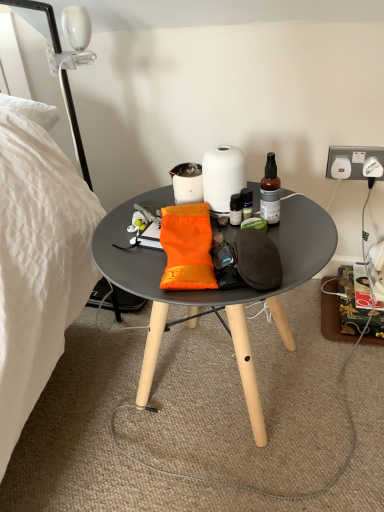
Measure the distance between point (346,172) and camera.

Point (346,172) is 3.65 feet away from camera.

The width and height of the screenshot is (384, 512). What do you see at coordinates (222, 176) in the screenshot?
I see `white matte paper towel at center` at bounding box center [222, 176].

The image size is (384, 512). What do you see at coordinates (187, 183) in the screenshot?
I see `matte white coffee cup at center` at bounding box center [187, 183].

At what (x,y) coordinates should I click in order to perform the action: click on matte black table at center. Please return your answer as a coordinate pair (x, y). This screenshot has width=384, height=512. Looking at the image, I should click on (213, 290).

Identify the location of translucent glass bottle at upper right. (270, 192).

Is white glossy lamp at upper left at the back of matte white coffee cup at center?

No, matte white coffee cup at center is not facing away from white glossy lamp at upper left.

Which is less distant, (x=195, y=184) or (x=63, y=90)?

The point (x=195, y=184) is closer.

The image size is (384, 512). I want to click on coffee cup lying on the right of white glossy lamp at upper left, so point(187,183).

Between matte white coffee cup at center and white glossy lamp at upper left, which one appears on the left side from the viewer's perspective?

From the viewer's perspective, white glossy lamp at upper left appears more on the left side.

Considering the sizes of translucent glass bottle at upper right and matte black table at center in the image, is translucent glass bottle at upper right wider or thinner than matte black table at center?

Clearly, translucent glass bottle at upper right has less width compared to matte black table at center.

Considering the positions of points (263, 213) and (262, 295), is point (263, 213) farther from camera compared to point (262, 295)?

Yes, point (263, 213) is farther from viewer.

Is translucent glass bottle at upper right further to camera compared to matte black table at center?

That is True.

Considering the sizes of objects orange fabric pouch at center and white matte paper towel at center in the image provided, who is taller, orange fabric pouch at center or white matte paper towel at center?

Standing taller between the two is white matte paper towel at center.

You are a GUI agent. You are given a task and a screenshot of the screen. Output one action in this format:
    pyautogui.click(x=<x>, y=<y>)
    Task: Click on the paper towel behind the orange fabric pouch at center
    Image resolution: width=384 pixels, height=512 pixels.
    Given the screenshot: What is the action you would take?
    pyautogui.click(x=222, y=176)

Which of these two, orange fabric pouch at center or white matte paper towel at center, is wider?

Wider between the two is orange fabric pouch at center.

From the image's perspective, between orange fabric pouch at center and white matte paper towel at center, who is located below?

orange fabric pouch at center is shown below in the image.

From the image's perspective, is white plastic power outlet at upper right on top of translucent glass bottle at upper right?

Yes, from the image's perspective, white plastic power outlet at upper right is over translucent glass bottle at upper right.

How different are the orientations of white plastic power outlet at upper right and translucent glass bottle at upper right in degrees?

4.17 degrees.

Is point (362, 147) positioned before point (271, 181)?

No.

In the scene shown: Is white plastic power outlet at upper right wider or thinner than translucent glass bottle at upper right?

Clearly, white plastic power outlet at upper right has less width compared to translucent glass bottle at upper right.

From the image's perspective, does white plastic power outlet at upper right appear lower than matte black table at center?

No, from the image's perspective, white plastic power outlet at upper right is not beneath matte black table at center.

Is white plastic power outlet at upper right turned away from matte black table at center?

No, white plastic power outlet at upper right is not facing away from matte black table at center.

Is white plastic power outlet at upper right not near matte black table at center?

No, white plastic power outlet at upper right is not far from matte black table at center.

Considering the relative positions of white plastic power outlet at upper right and matte black table at center in the image provided, is white plastic power outlet at upper right to the left or to the right of matte black table at center?

From the image, it's evident that white plastic power outlet at upper right is to the right of matte black table at center.

Considering the sizes of objects white glossy lamp at upper left and white matte paper towel at center in the image provided, who is taller, white glossy lamp at upper left or white matte paper towel at center?

With more height is white glossy lamp at upper left.

Considering the sizes of white glossy lamp at upper left and white matte paper towel at center in the image, is white glossy lamp at upper left wider or thinner than white matte paper towel at center?

Considering their sizes, white glossy lamp at upper left looks broader than white matte paper towel at center.

Can you tell me how much white glossy lamp at upper left and white matte paper towel at center differ in facing direction?

The angle between the facing direction of white glossy lamp at upper left and the facing direction of white matte paper towel at center is 0.669 degrees.

Between matte white coffee cup at center and white plastic power outlet at upper right, which one is positioned in front?

matte white coffee cup at center is in front.

Find the location of a particular element. The width and height of the screenshot is (384, 512). power outlet behind the matte white coffee cup at center is located at coordinates (352, 161).

Would you say matte white coffee cup at center is outside white plastic power outlet at upper right?

Yes.

Is matte white coffee cup at center facing away from white plastic power outlet at upper right?

No, matte white coffee cup at center is not facing away from white plastic power outlet at upper right.

I want to click on coffee cup behind the white glossy lamp at upper left, so click(187, 183).

Where is `bottle that is on the right side of matte black table at center`? bottle that is on the right side of matte black table at center is located at coordinates (270, 192).

Estimate the real-world distances between objects in this image. Which object is closer to orange fabric pouch at center, matte white coffee cup at center or white matte paper towel at center?

The object closer to orange fabric pouch at center is white matte paper towel at center.

Which object lies nearer to the anchor point matte black table at center, white glossy lamp at upper left or matte white coffee cup at center?

matte white coffee cup at center is closer to matte black table at center.

Based on their spatial positions, is matte black table at center or white glossy lamp at upper left closer to white matte paper towel at center?

matte black table at center.

Estimate the real-world distances between objects in this image. Which object is closer to orange fabric pouch at center, matte black table at center or white matte paper towel at center?

white matte paper towel at center lies closer to orange fabric pouch at center than the other object.

Estimate the real-world distances between objects in this image. Which object is closer to orange fabric pouch at center, matte white coffee cup at center or matte black table at center?

Based on the image, matte white coffee cup at center appears to be nearer to orange fabric pouch at center.

Consider the image. Estimate the real-world distances between objects in this image. Which object is further from white matte paper towel at center, white glossy lamp at upper left or matte black table at center?

white glossy lamp at upper left lies further to white matte paper towel at center than the other object.

From the image, which object appears to be nearer to white plastic power outlet at upper right, white matte paper towel at center or matte black table at center?

white matte paper towel at center is closer to white plastic power outlet at upper right.

Looking at the image, which one is located further to translucent glass bottle at upper right, orange fabric pouch at center or white plastic power outlet at upper right?

white plastic power outlet at upper right is further to translucent glass bottle at upper right.

This screenshot has height=512, width=384. Find the location of `bottle between white glossy lamp at upper left and white plastic power outlet at upper right in the horizontal direction`. bottle between white glossy lamp at upper left and white plastic power outlet at upper right in the horizontal direction is located at coordinates (270, 192).

Identify the location of paper towel between matte black table at center and white plastic power outlet at upper right from front to back. (222, 176).

Where is `paper towel located between matte white coffee cup at center and white plastic power outlet at upper right in the left-right direction`? The image size is (384, 512). paper towel located between matte white coffee cup at center and white plastic power outlet at upper right in the left-right direction is located at coordinates [222, 176].

Where is `coffee cup between white glossy lamp at upper left and translucent glass bottle at upper right`? This screenshot has height=512, width=384. coffee cup between white glossy lamp at upper left and translucent glass bottle at upper right is located at coordinates (187, 183).